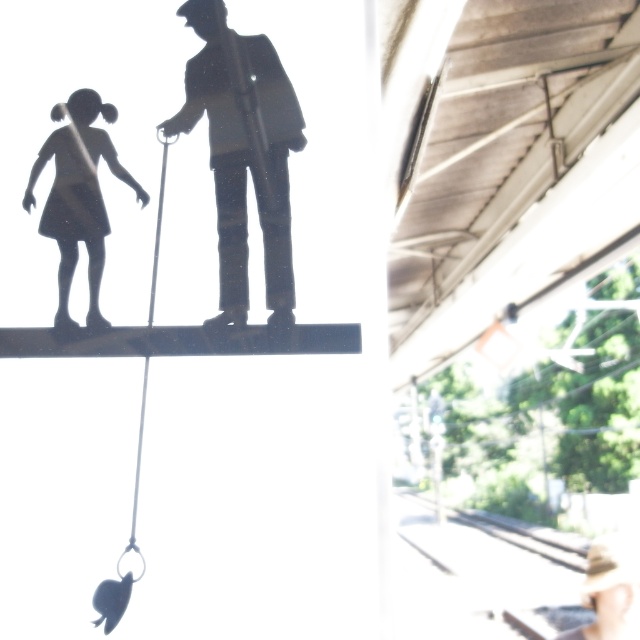
Question: Which of the following is the closest to the observer?

Choices:
 (A) silhouette figure at center
 (B) matte black figure at left

Answer: (A)

Question: Does silhouette figure at center have a smaller size compared to matte black figure at left?

Choices:
 (A) no
 (B) yes

Answer: (A)

Question: Is silhouette figure at center positioned behind matte black figure at left?

Choices:
 (A) yes
 (B) no

Answer: (B)

Question: In this image, where is silhouette figure at center located relative to matte black figure at left?

Choices:
 (A) right
 (B) left

Answer: (A)

Question: Among these objects, which one is farthest from the camera?

Choices:
 (A) silhouette figure at center
 (B) matte black figure at left

Answer: (B)

Question: Which of the following is the farthest from the observer?

Choices:
 (A) (296, 145)
 (B) (96, 227)

Answer: (B)